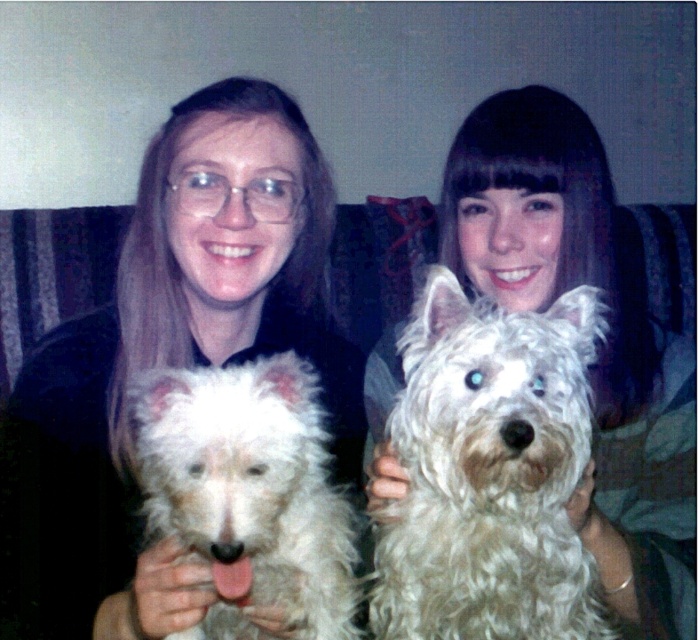
Does matte black shirt at center appear on the left side of fluffy white dog at center?

Yes, matte black shirt at center is to the left of fluffy white dog at center.

Is matte black shirt at center wider than fluffy white dog at center?

Yes, matte black shirt at center is wider than fluffy white dog at center.

Which is in front, point (357, 355) or point (429, 275)?

Positioned in front is point (429, 275).

Find the location of `matte black shirt at center`. matte black shirt at center is located at coordinates (184, 317).

Is point (179, 272) more distant than point (304, 525)?

Yes, point (179, 272) is behind point (304, 525).

Between matte black shirt at center and white fluffy dog at center, which one appears on the right side from the viewer's perspective?

white fluffy dog at center

Is point (170, 166) positioned after point (352, 522)?

Yes, point (170, 166) is farther from viewer.

What are the coordinates of `matte black shirt at center` in the screenshot? It's located at (184, 317).

Between point (570, 449) and point (144, 515), which one is positioned in front?

Positioned in front is point (570, 449).

Which is more to the right, fluffy white dog at center or white fluffy dog at center?

From the viewer's perspective, fluffy white dog at center appears more on the right side.

The image size is (698, 640). What are the coordinates of `fluffy white dog at center` in the screenshot? It's located at (489, 472).